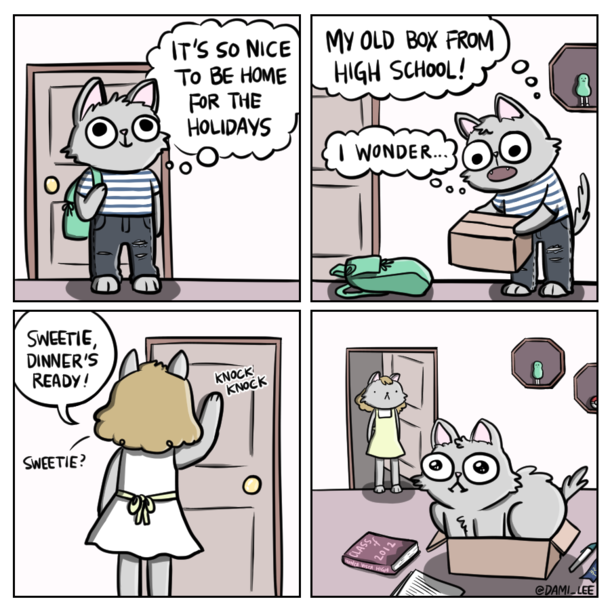
Where is `wall hangings`? The width and height of the screenshot is (610, 610). wall hangings is located at coordinates (542, 354), (583, 389), (581, 65).